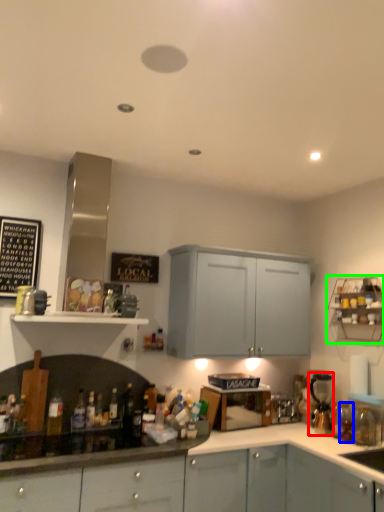
Question: Estimate the real-world distances between objects in this image. Which object is closer to coffee machine (highlighted by a red box), bottle (highlighted by a blue box) or shelf (highlighted by a green box)?

Choices:
 (A) bottle
 (B) shelf

Answer: (A)